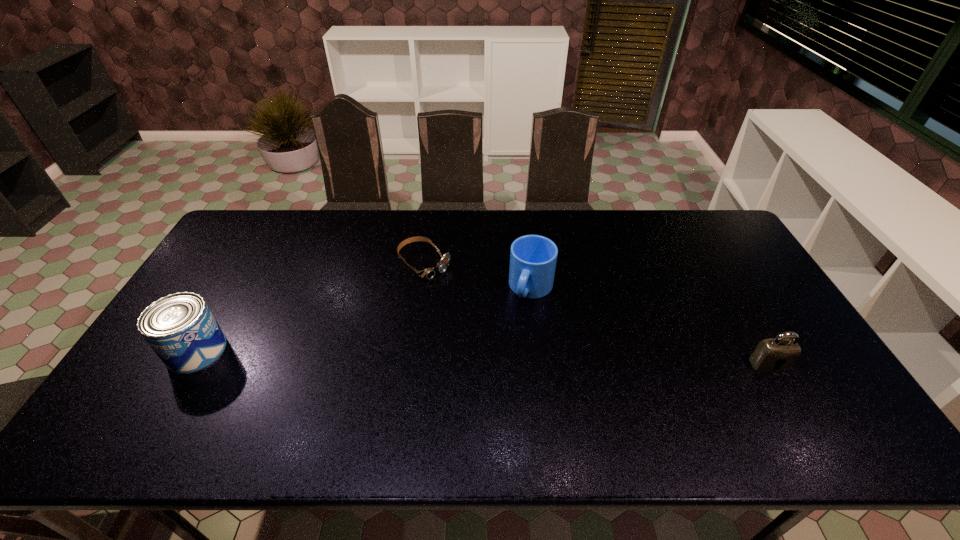
Locate an element on the screen. The image size is (960, 540). vacant space at the far right corner is located at coordinates (703, 212).

At what (x,y) coordinates should I click in order to perform the action: click on free space between the shortest object and the leftmost object. Please return your answer as a coordinate pair (x, y). The image size is (960, 540). Looking at the image, I should click on (311, 307).

Where is `vacant area that lies between the padlock and the leftmost object`? The height and width of the screenshot is (540, 960). vacant area that lies between the padlock and the leftmost object is located at coordinates (483, 357).

The width and height of the screenshot is (960, 540). Identify the location of free space that is in between the goggles and the third object from left to right. (478, 276).

Locate an element on the screen. The width and height of the screenshot is (960, 540). vacant space in between the mug and the third object from right to left is located at coordinates (478, 276).

The width and height of the screenshot is (960, 540). Identify the location of free space between the mug and the shortest object. (478, 276).

The height and width of the screenshot is (540, 960). I want to click on empty space that is in between the goggles and the rightmost object, so click(x=597, y=314).

You are a GUI agent. You are given a task and a screenshot of the screen. Output one action in this format:
    pyautogui.click(x=<x>, y=<y>)
    Task: Click on the vacant area between the goggles and the can
    
    Given the screenshot: What is the action you would take?
    pyautogui.click(x=311, y=307)

You are a GUI agent. You are given a task and a screenshot of the screen. Output one action in this format:
    pyautogui.click(x=<x>, y=<y>)
    Task: Click on the vacant area that lies between the mug and the leftmost object
    This screenshot has width=960, height=540.
    Given the screenshot: What is the action you would take?
    pyautogui.click(x=364, y=320)

Find the location of a particular element. vacant area that lies between the mug and the can is located at coordinates (364, 320).